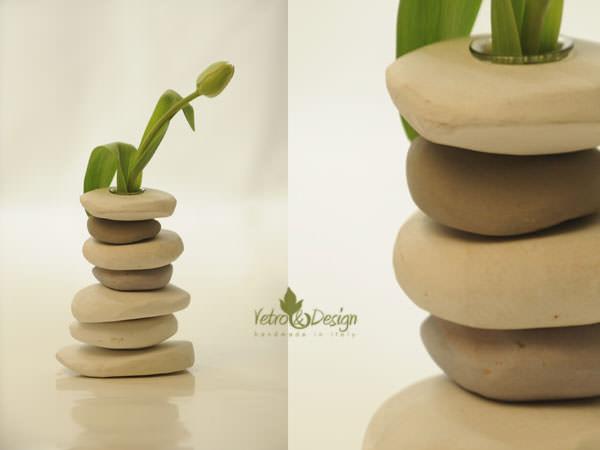
Find the location of a particular element. reflection of stones on tabletop is located at coordinates (413, 427), (162, 388), (152, 402), (149, 417), (153, 433), (153, 441).